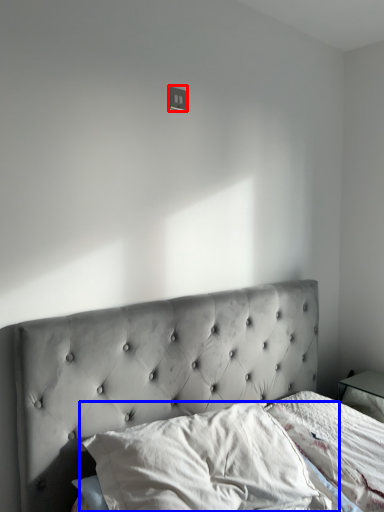
Question: Which of the following is the closest to the observer, electric outlet (highlighted by a red box) or pillow (highlighted by a blue box)?

Choices:
 (A) electric outlet
 (B) pillow

Answer: (B)